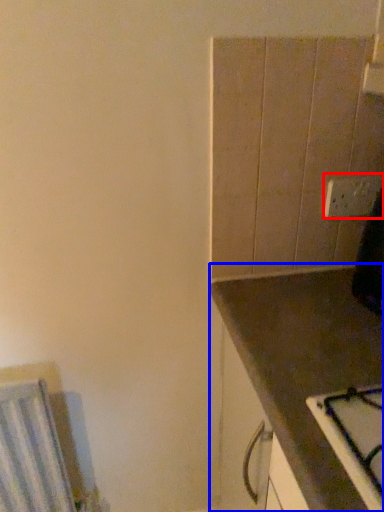
Question: Which of the following is the closest to the observer, electric outlet (highlighted by a red box) or countertop (highlighted by a blue box)?

Choices:
 (A) electric outlet
 (B) countertop

Answer: (B)